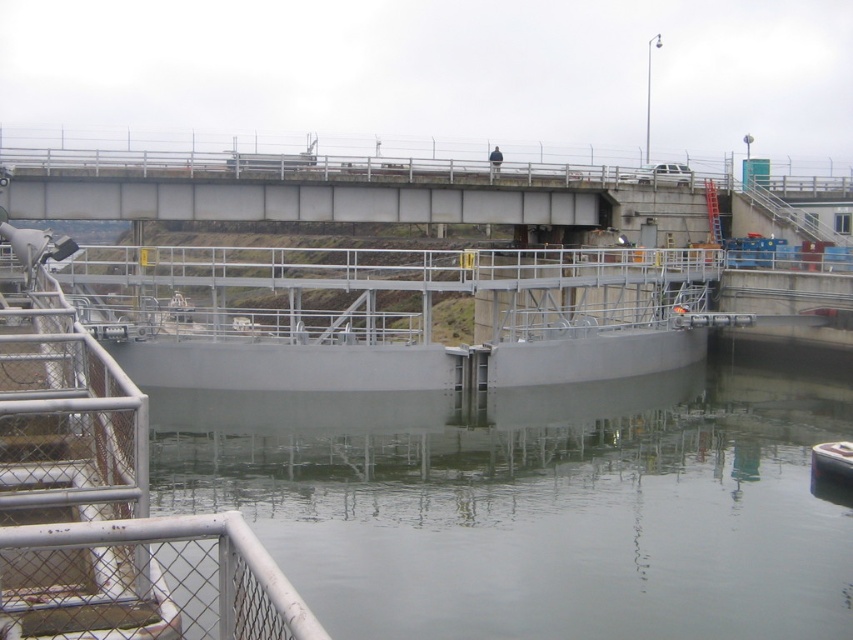
Question: Which of the following is the farthest from the observer?

Choices:
 (A) gray metallic water at center
 (B) metallic gray boat at lower right

Answer: (B)

Question: Can you confirm if gray metallic water at center is smaller than metallic gray boat at lower right?

Choices:
 (A) no
 (B) yes

Answer: (A)

Question: Which of the following is the closest to the observer?

Choices:
 (A) gray metallic water at center
 (B) metallic gray boat at lower right

Answer: (A)

Question: Is gray metallic water at center smaller than metallic gray boat at lower right?

Choices:
 (A) yes
 (B) no

Answer: (B)

Question: Is gray metallic water at center below metallic gray boat at lower right?

Choices:
 (A) yes
 (B) no

Answer: (B)